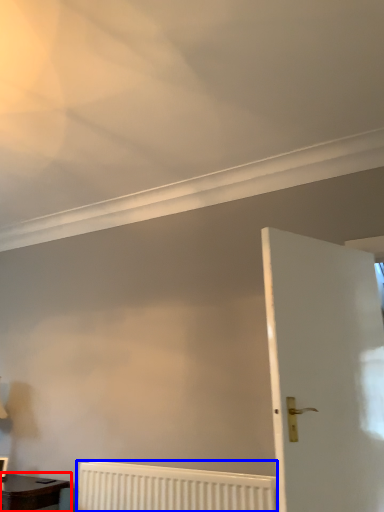
Question: Which object appears farthest to the camera in this image, table (highlighted by a red box) or radiator (highlighted by a blue box)?

Choices:
 (A) table
 (B) radiator

Answer: (A)